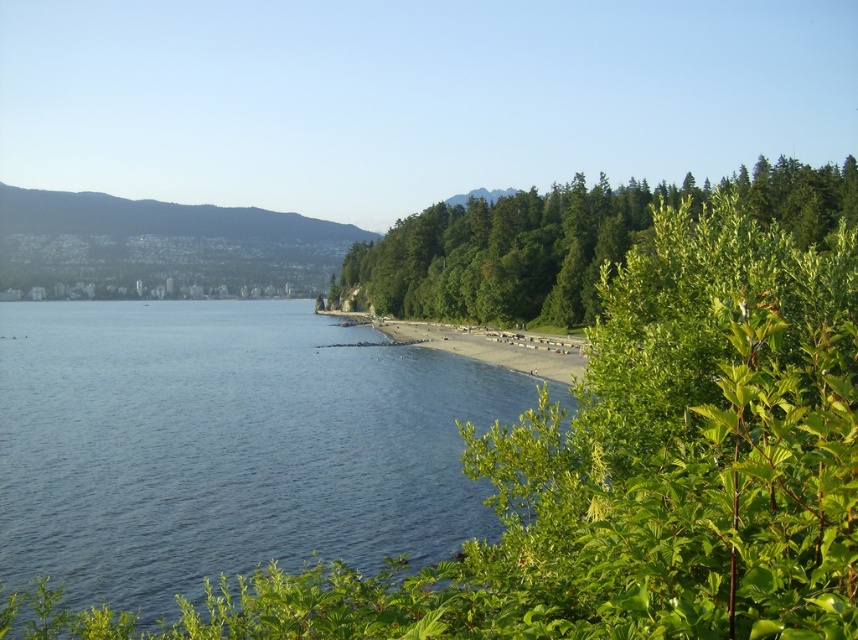
Which is in front, point (300, 404) or point (363, 272)?

Point (300, 404) is more forward.

Can you confirm if blue water at lower left is taller than green leafy trees at center?

In fact, blue water at lower left may be shorter than green leafy trees at center.

Measure the distance between point (189, 452) and camera.

44.42 meters

The height and width of the screenshot is (640, 858). In order to click on blue water at lower left in this screenshot , I will do `click(227, 445)`.